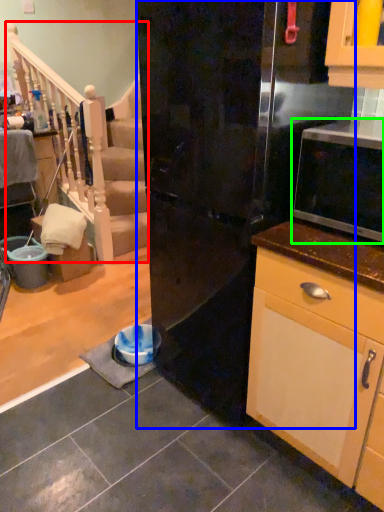
Question: Considering the real-world distances, which object is farthest from rail (highlighted by a red box)? refrigerator (highlighted by a blue box) or microwave oven (highlighted by a green box)?

Choices:
 (A) refrigerator
 (B) microwave oven

Answer: (B)